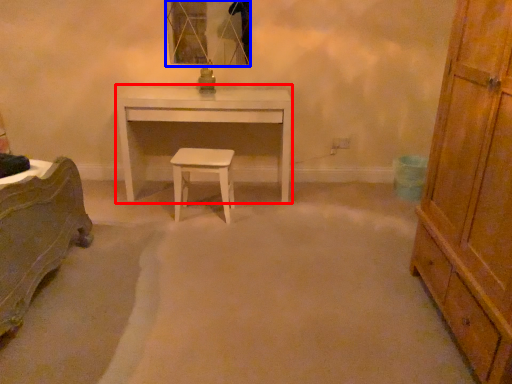
Question: Which object appears closest to the camera in this image, desk (highlighted by a red box) or mirror (highlighted by a blue box)?

Choices:
 (A) desk
 (B) mirror

Answer: (A)